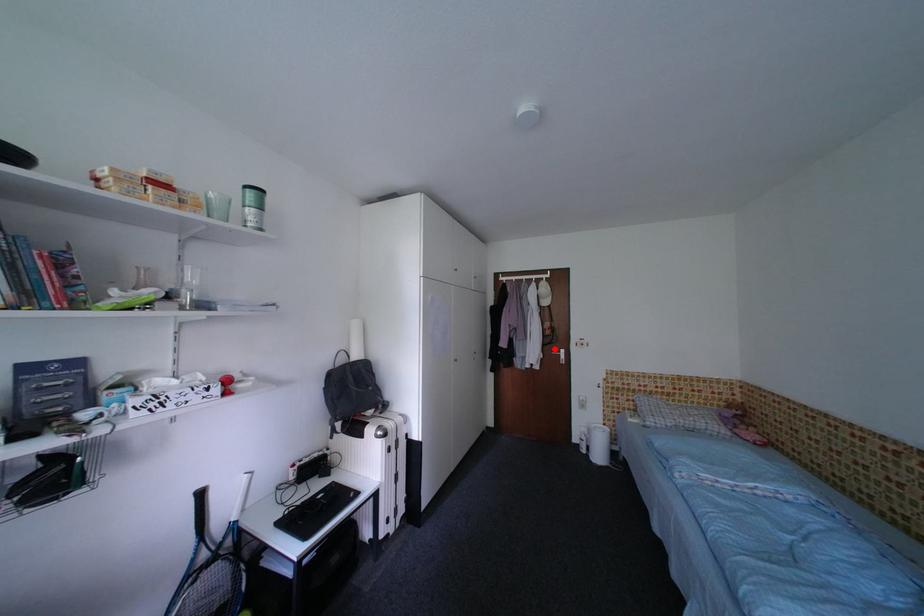
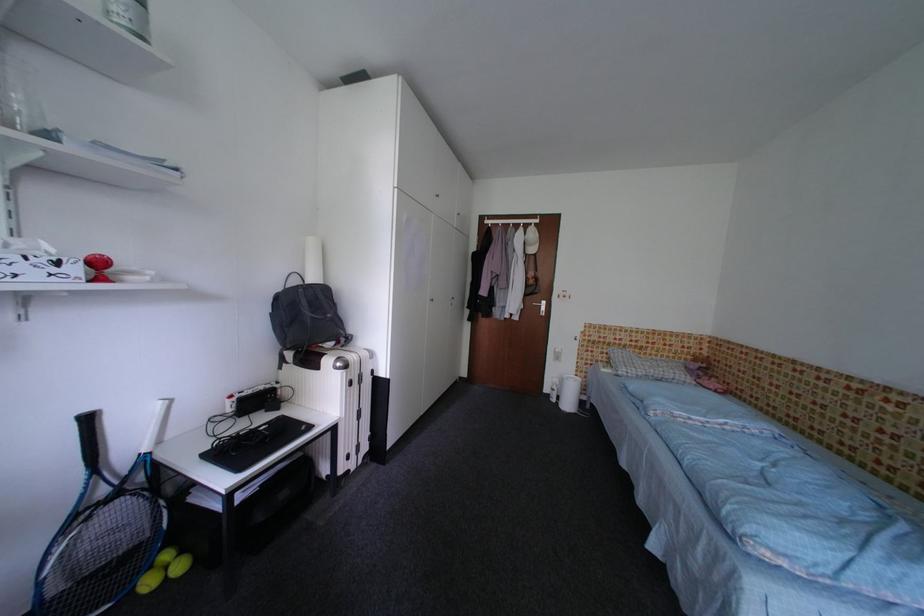
In the second image, find the point that corresponds to the highlighted location in the first image.

(536, 300)